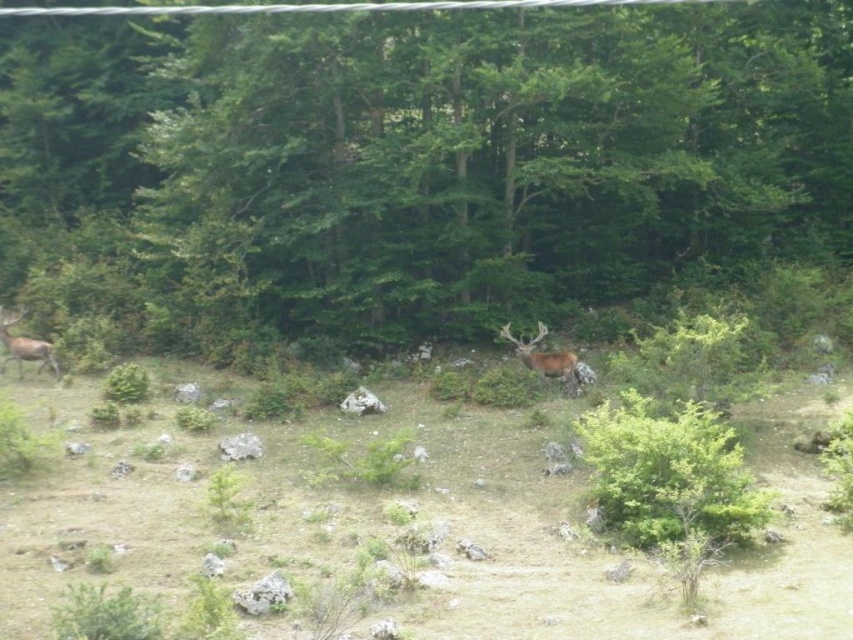
Question: Which object is positioned closest to the brown velvet deer at left?

Choices:
 (A) green leafy tree at center
 (B) brown velvet deer at center

Answer: (B)

Question: Considering the relative positions of green leafy tree at center and brown velvet deer at left in the image provided, where is green leafy tree at center located with respect to brown velvet deer at left?

Choices:
 (A) above
 (B) below

Answer: (A)

Question: Which object appears closest to the camera in this image?

Choices:
 (A) green leafy tree at center
 (B) brown velvet deer at left

Answer: (A)

Question: Can you confirm if brown velvet deer at center is wider than brown velvet deer at left?

Choices:
 (A) no
 (B) yes

Answer: (A)

Question: Does green leafy tree at center appear over brown velvet deer at left?

Choices:
 (A) yes
 (B) no

Answer: (A)

Question: Which object appears farthest from the camera in this image?

Choices:
 (A) brown velvet deer at left
 (B) brown velvet deer at center
 (C) green leafy tree at center

Answer: (A)